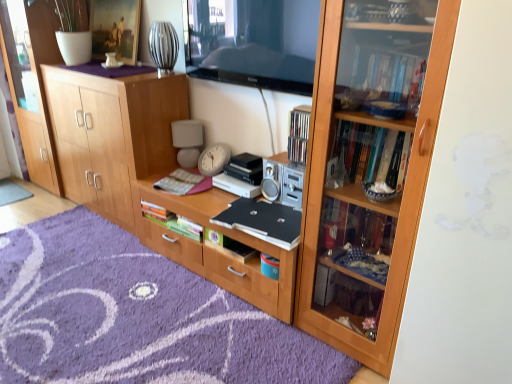
Question: Is hardcover book at center, which ranks as the second book in top-to-bottom order, further to camera compared to transparent wood cabinet at left?

Choices:
 (A) no
 (B) yes

Answer: (A)

Question: Could you tell me if hardcover book at center, positioned as the second book in bottom-to-top order, is facing transparent wood cabinet at left?

Choices:
 (A) no
 (B) yes

Answer: (A)

Question: From the image's perspective, does hardcover book at center, which ranks as the second book in top-to-bottom order, appear lower than transparent wood cabinet at left?

Choices:
 (A) no
 (B) yes

Answer: (B)

Question: Would you say transparent wood cabinet at left is part of hardcover book at center, which ranks as the second book in top-to-bottom order,'s contents?

Choices:
 (A) no
 (B) yes

Answer: (A)

Question: Does hardcover book at center, positioned as the second book in bottom-to-top order, appear on the right side of transparent wood cabinet at left?

Choices:
 (A) no
 (B) yes

Answer: (B)

Question: Is hardcover book at center, positioned as the second book in bottom-to-top order, bigger than transparent wood cabinet at left?

Choices:
 (A) no
 (B) yes

Answer: (A)

Question: Can you confirm if hardcover book at center, arranged as the 1th book when ordered from the bottom, is positioned to the right of wooden bookcase at right?

Choices:
 (A) no
 (B) yes

Answer: (A)

Question: Is hardcover book at center, which appears as the 3th book when viewed from the top, thinner than wooden bookcase at right?

Choices:
 (A) yes
 (B) no

Answer: (A)

Question: Can you confirm if hardcover book at center, which appears as the 3th book when viewed from the top, is positioned to the left of wooden bookcase at right?

Choices:
 (A) yes
 (B) no

Answer: (A)

Question: From the image's perspective, does hardcover book at center, which appears as the 3th book when viewed from the top, appear lower than wooden bookcase at right?

Choices:
 (A) no
 (B) yes

Answer: (B)

Question: Does hardcover book at center, arranged as the 1th book when ordered from the bottom, have a larger size compared to wooden bookcase at right?

Choices:
 (A) no
 (B) yes

Answer: (A)

Question: Does hardcover book at center, arranged as the 1th book when ordered from the bottom, have a lesser height compared to wooden bookcase at right?

Choices:
 (A) no
 (B) yes

Answer: (B)

Question: Is transparent wood cabinet at left positioned behind wooden cabinet at center?

Choices:
 (A) no
 (B) yes

Answer: (B)